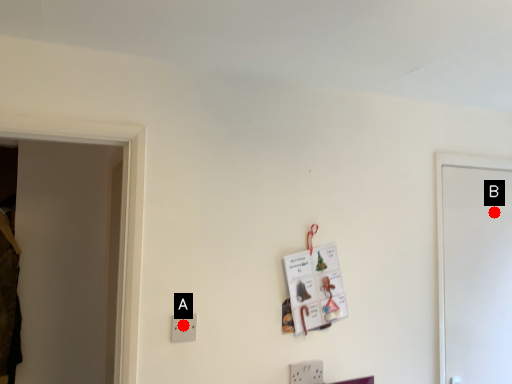
Question: Two points are circled on the image, labeled by A and B beside each circle. Which point is farther from the camera taking this photo?

Choices:
 (A) A is further
 (B) B is further

Answer: (B)